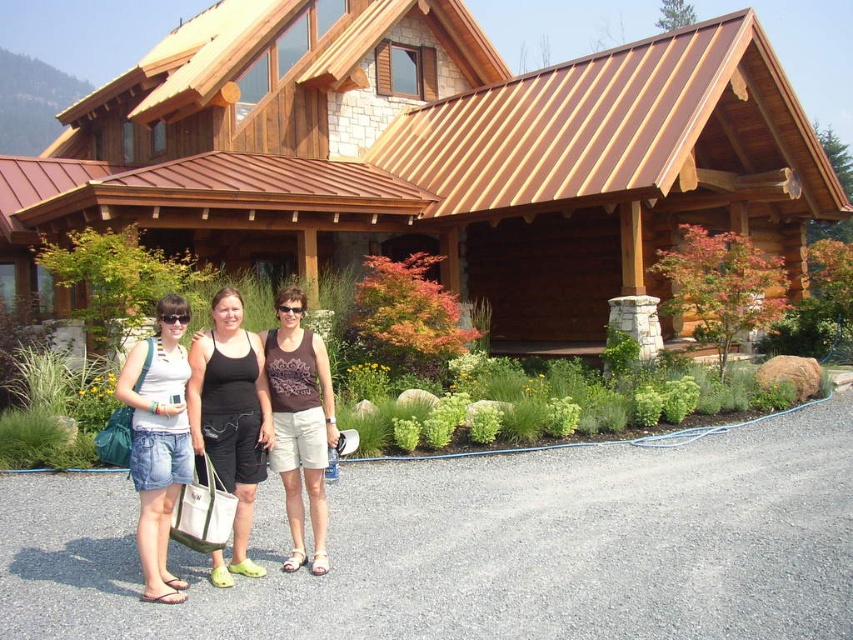
Question: Among these objects, which one is nearest to the camera?

Choices:
 (A) denim shorts at center
 (B) gray gravel driveway at lower center

Answer: (B)

Question: Does gray gravel driveway at lower center appear under denim shorts at center?

Choices:
 (A) no
 (B) yes

Answer: (B)

Question: Estimate the real-world distances between objects in this image. Which object is farther from the brown fabric tank top at center?

Choices:
 (A) wooden cabin at center
 (B) black fabric shorts at center
 (C) denim shorts at center
 (D) gray gravel driveway at lower center

Answer: (A)

Question: Among these points, which one is nearest to the camera?

Choices:
 (A) (158, 321)
 (B) (453, 68)
 (C) (299, 422)
 (D) (815, 531)

Answer: (A)

Question: Does denim shorts at center appear over brown fabric tank top at center?

Choices:
 (A) yes
 (B) no

Answer: (B)

Question: Is black fabric shorts at center bigger than denim shorts at center?

Choices:
 (A) yes
 (B) no

Answer: (A)